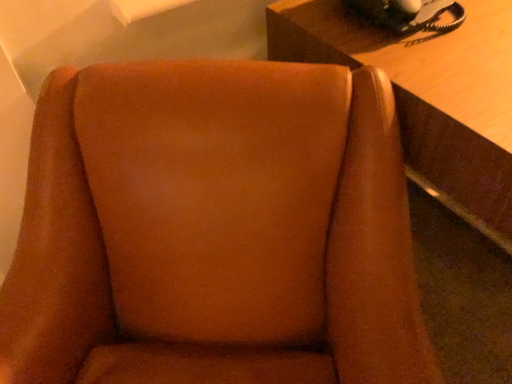
Image resolution: width=512 pixels, height=384 pixels. What do you see at coordinates (215, 230) in the screenshot? I see `brown suede chair at center` at bounding box center [215, 230].

Image resolution: width=512 pixels, height=384 pixels. Identify the location of wooden table at upper right. (428, 96).

Which object is further away from the camera, wooden table at upper right or brown suede chair at center?

wooden table at upper right.

From the picture: From a real-world perspective, is wooden table at upper right located beneath brown suede chair at center?

Yes, from a real-world perspective, wooden table at upper right is below brown suede chair at center.

I want to click on table to the right of brown suede chair at center, so click(428, 96).

Is brown suede chair at center surrounded by wooden table at upper right?

Definitely not — brown suede chair at center is not inside wooden table at upper right.

Is brown suede chair at center not within black rubberized phone at upper right?

Yes.

From the image's perspective, which one is positioned lower, brown suede chair at center or black rubberized phone at upper right?

brown suede chair at center, from the image's perspective.

Is point (208, 181) closer or farther from the camera than point (432, 13)?

Point (208, 181) is positioned closer to the camera compared to point (432, 13).

Consider the image. Is brown suede chair at center in contact with black rubberized phone at upper right?

brown suede chair at center is not next to black rubberized phone at upper right, and they're not touching.

Locate an element on the screen. Image resolution: width=512 pixels, height=384 pixels. chair that is under the black rubberized phone at upper right (from a real-world perspective) is located at coordinates (215, 230).

Can you confirm if black rubberized phone at upper right is shorter than brown suede chair at center?

Yes.

Does black rubberized phone at upper right have a lesser width compared to brown suede chair at center?

Yes, black rubberized phone at upper right is thinner than brown suede chair at center.

How many degrees apart are the facing directions of black rubberized phone at upper right and wooden table at upper right?

3.32 degrees separate the facing orientations of black rubberized phone at upper right and wooden table at upper right.

Is black rubberized phone at upper right facing away from wooden table at upper right?

That's not correct — black rubberized phone at upper right is not looking away from wooden table at upper right.

From a real-world perspective, is black rubberized phone at upper right located higher than wooden table at upper right?

A: Yes, from a real-world perspective, black rubberized phone at upper right is above wooden table at upper right.

Is point (395, 16) in front of point (304, 46)?

That is True.

Is brown suede chair at center not within wooden table at upper right?

Yes, brown suede chair at center is not within wooden table at upper right.

Visually, is brown suede chair at center positioned to the left or to the right of wooden table at upper right?

Based on their positions, brown suede chair at center is located to the left of wooden table at upper right.

Can you confirm if brown suede chair at center is bigger than wooden table at upper right?

Actually, brown suede chair at center might be smaller than wooden table at upper right.

Which of these two, brown suede chair at center or wooden table at upper right, stands taller?

With more height is brown suede chair at center.

Is wooden table at upper right turned away from black rubberized phone at upper right?

No, black rubberized phone at upper right is not at the back of wooden table at upper right.

Between wooden table at upper right and black rubberized phone at upper right, which one has more height?

wooden table at upper right.

From the image's perspective, is wooden table at upper right located above black rubberized phone at upper right?

No, from the image's perspective, wooden table at upper right is not above black rubberized phone at upper right.

In order to click on chair located above the wooden table at upper right (from a real-world perspective) in this screenshot , I will do `click(215, 230)`.

Locate an element on the screen. The height and width of the screenshot is (384, 512). corded phone above the brown suede chair at center (from the image's perspective) is located at coordinates (409, 15).

Estimate the real-world distances between objects in this image. Which object is further from wooden table at upper right, black rubberized phone at upper right or brown suede chair at center?

brown suede chair at center is further to wooden table at upper right.

When comparing their distances from black rubberized phone at upper right, does brown suede chair at center or wooden table at upper right seem further?

Based on the image, brown suede chair at center appears to be further to black rubberized phone at upper right.

In the scene shown: When comparing their distances from brown suede chair at center, does black rubberized phone at upper right or wooden table at upper right seem further?

black rubberized phone at upper right is positioned further to the anchor brown suede chair at center.

From the image, which object appears to be farther from black rubberized phone at upper right, wooden table at upper right or brown suede chair at center?

brown suede chair at center is positioned further to the anchor black rubberized phone at upper right.

Considering their positions, is wooden table at upper right positioned closer to brown suede chair at center than black rubberized phone at upper right?

wooden table at upper right.

Considering their positions, is brown suede chair at center positioned further to wooden table at upper right than black rubberized phone at upper right?

brown suede chair at center is further to wooden table at upper right.

The height and width of the screenshot is (384, 512). Identify the location of corded phone between brown suede chair at center and wooden table at upper right from left to right. (409, 15).